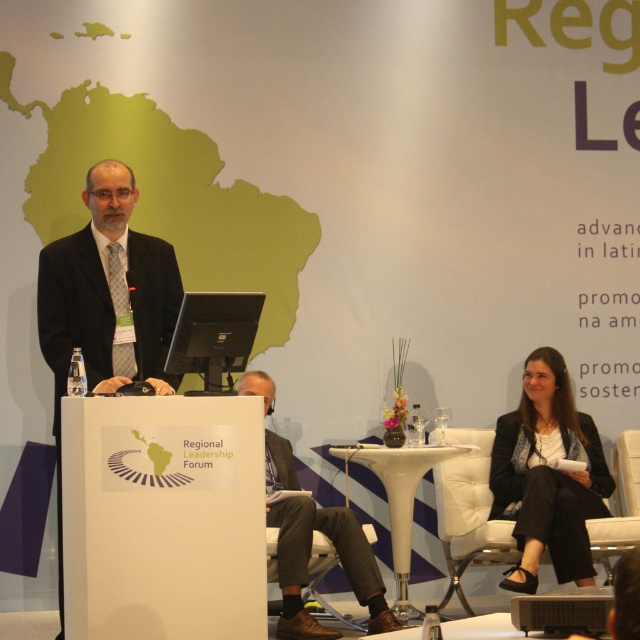
You are attending the Regional Leadership Forum and notice a point marked at coordinates (106, 304). What object does this point correspond to?

The point corresponds to the black suit at center.

You are an attendee at the Regional Leadership Forum. You need to sit down quickly. There is a black suit at center and a white leather chair at lower right. Which one is closer to your current position if you are standing in the center of the room?

The black suit at center is closer to your current position because it is located to the left of the white leather chair at lower right, meaning it is nearer to the center of the room.